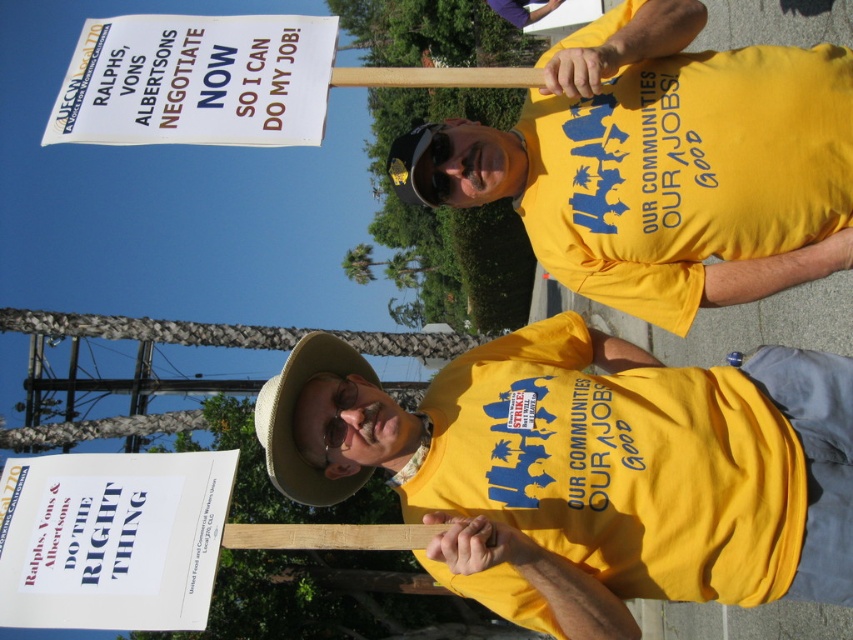
Question: Which object is the closest to the yellow cotton shirt at center?

Choices:
 (A) yellow cotton shirt at upper right
 (B) tan straw cowboy hat at center

Answer: (B)

Question: Among these objects, which one is nearest to the camera?

Choices:
 (A) yellow cotton shirt at upper right
 (B) tan straw cowboy hat at center
 (C) yellow cotton shirt at center

Answer: (C)

Question: Is yellow cotton shirt at upper right further to the viewer compared to tan straw cowboy hat at center?

Choices:
 (A) no
 (B) yes

Answer: (A)

Question: Is yellow cotton shirt at center to the right of white paper sign at upper left from the viewer's perspective?

Choices:
 (A) yes
 (B) no

Answer: (A)

Question: Is yellow cotton shirt at center smaller than yellow cotton shirt at upper right?

Choices:
 (A) no
 (B) yes

Answer: (A)

Question: Which object is the farthest from the tan straw cowboy hat at center?

Choices:
 (A) yellow cotton shirt at upper right
 (B) yellow cotton shirt at center

Answer: (A)